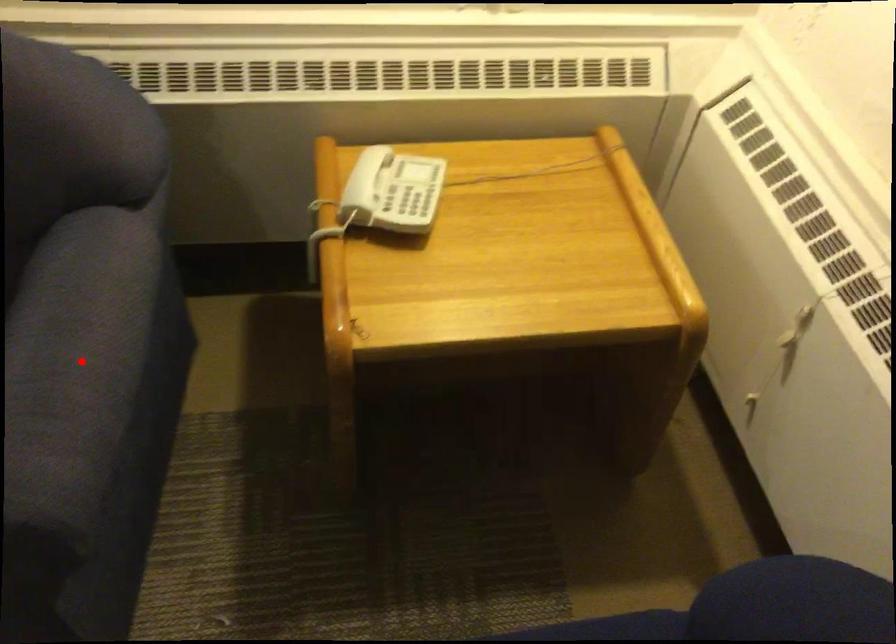
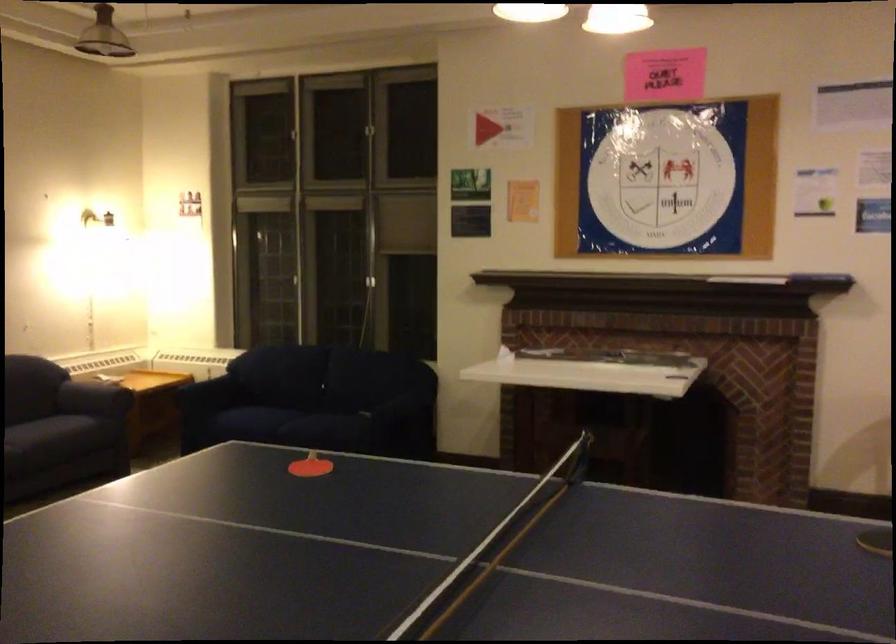
Question: I am providing you with two images of the same scene from different viewpoints. A red point is marked on the first image. Is the red point's position out of view in image 2?

Choices:
 (A) Yes
 (B) No

Answer: (A)